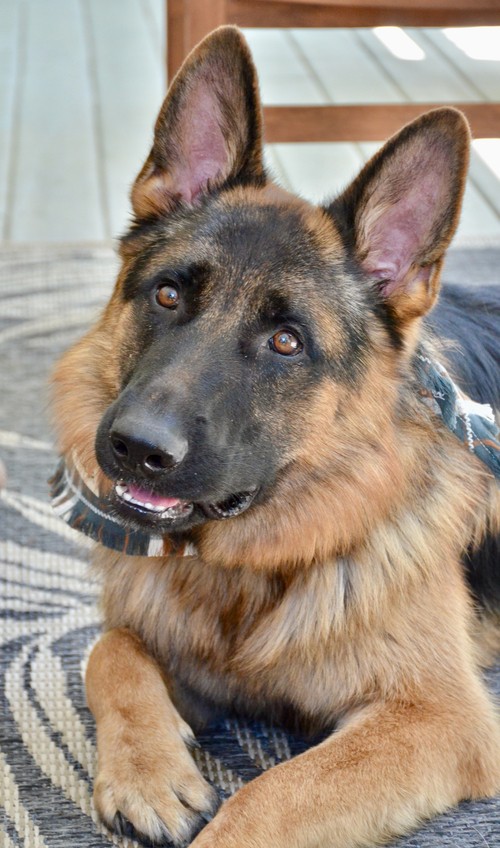
Find the location of a particular element. This screenshot has width=500, height=848. floor boards is located at coordinates (65, 109).